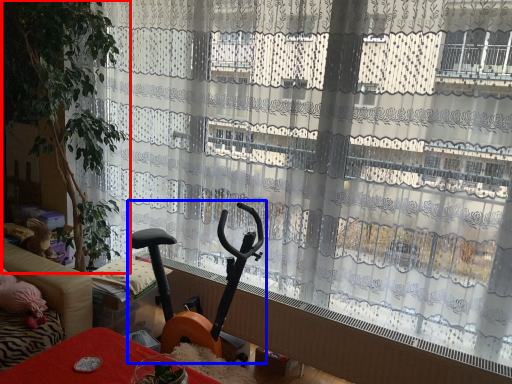
Question: Which point is further to the camera, plant (highlighted by a red box) or baby carriage (highlighted by a blue box)?

Choices:
 (A) plant
 (B) baby carriage

Answer: (A)